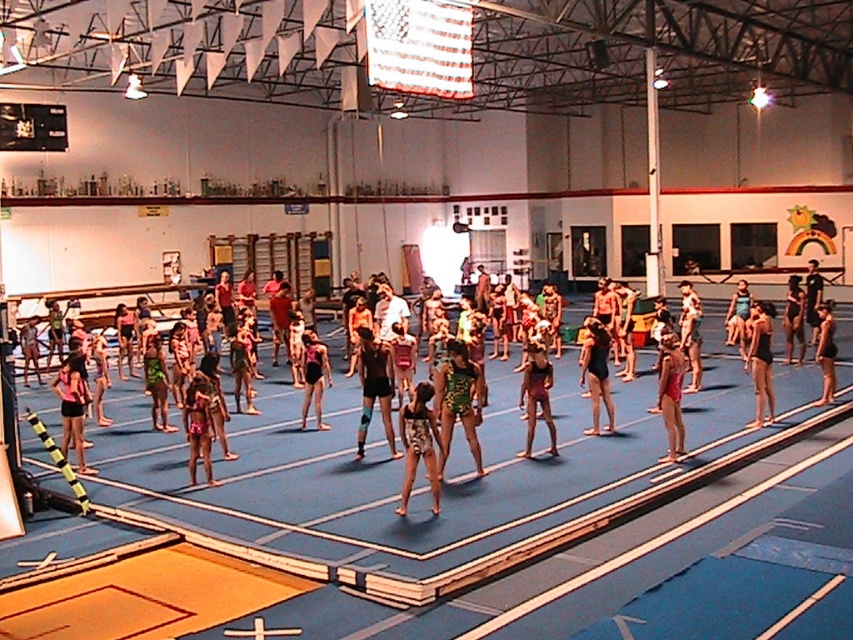
Question: Does multicolored swimsuit at center appear on the left side of black matte swimsuit at center?

Choices:
 (A) yes
 (B) no

Answer: (A)

Question: Which point is farther to the camera?

Choices:
 (A) (366, 524)
 (B) (762, 317)

Answer: (B)

Question: Is multicolored swimsuit at center thinner than matte black leotard at center?

Choices:
 (A) no
 (B) yes

Answer: (A)

Question: Does printed fabric swimsuit at center have a greater width compared to matte black leotard at center?

Choices:
 (A) no
 (B) yes

Answer: (A)

Question: Which object is the farthest from the printed fabric swimsuit at center?

Choices:
 (A) multicolored swimsuit at center
 (B) black matte swimsuit at center

Answer: (B)

Question: Which object is closer to the camera taking this photo?

Choices:
 (A) matte black leotard at center
 (B) multicolored swimsuit at center
 (C) black matte swimsuit at center

Answer: (B)